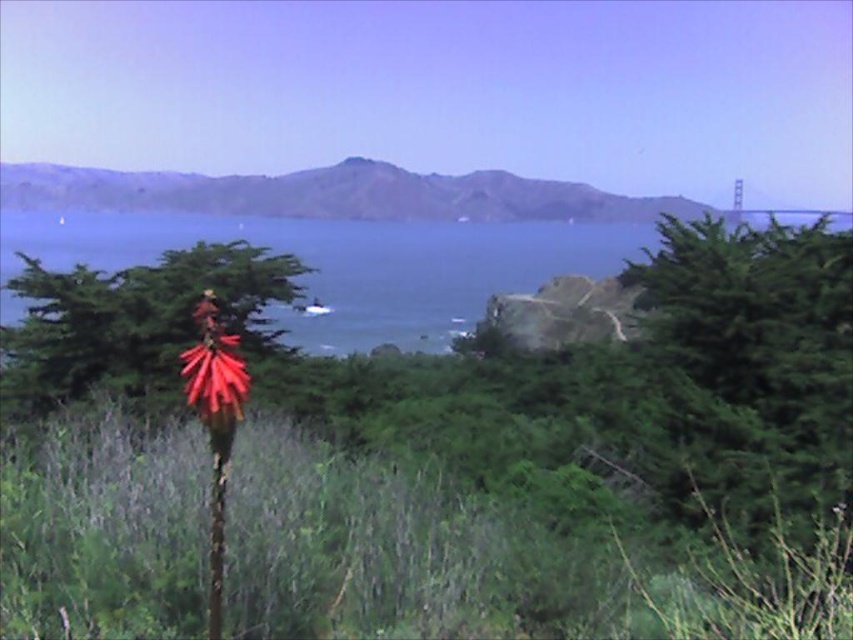
In the scene shown: Can you confirm if green textured tree at right is positioned above red matte flower at center?

Indeed, green textured tree at right is positioned over red matte flower at center.

Is point (809, 234) behind point (19, 404)?

Yes, it is behind point (19, 404).

Where is `green textured tree at right`? green textured tree at right is located at coordinates (752, 362).

The height and width of the screenshot is (640, 853). What are the coordinates of `green textured tree at right` in the screenshot? It's located at 752,362.

Is point (552, 198) less distant than point (213, 310)?

No, (552, 198) is further to viewer.

Which is more to the left, green grassy hillside at upper center or bright red spiky flower at center?

Positioned to the left is green grassy hillside at upper center.

The height and width of the screenshot is (640, 853). Describe the element at coordinates (332, 195) in the screenshot. I see `green grassy hillside at upper center` at that location.

Locate an element on the screen. The height and width of the screenshot is (640, 853). green grassy hillside at upper center is located at coordinates (332, 195).

Does red matte flower at center have a greater width compared to green grassy hillside at upper center?

No, red matte flower at center is not wider than green grassy hillside at upper center.

Can you confirm if red matte flower at center is bigger than green grassy hillside at upper center?

No.

Is point (117, 324) positioned behind point (497, 173)?

No.

Locate an element on the screen. This screenshot has height=640, width=853. red matte flower at center is located at coordinates (134, 321).